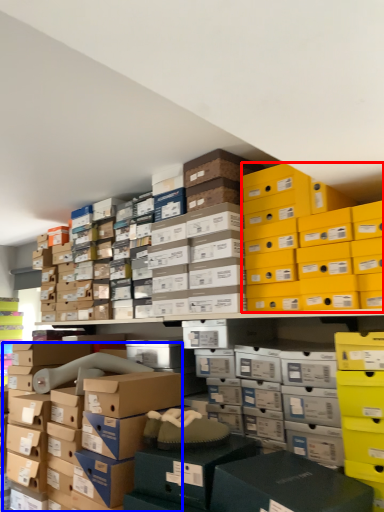
Question: Which object appears farthest to the camera in this image, storage box (highlighted by a red box) or storage box (highlighted by a blue box)?

Choices:
 (A) storage box
 (B) storage box

Answer: (B)